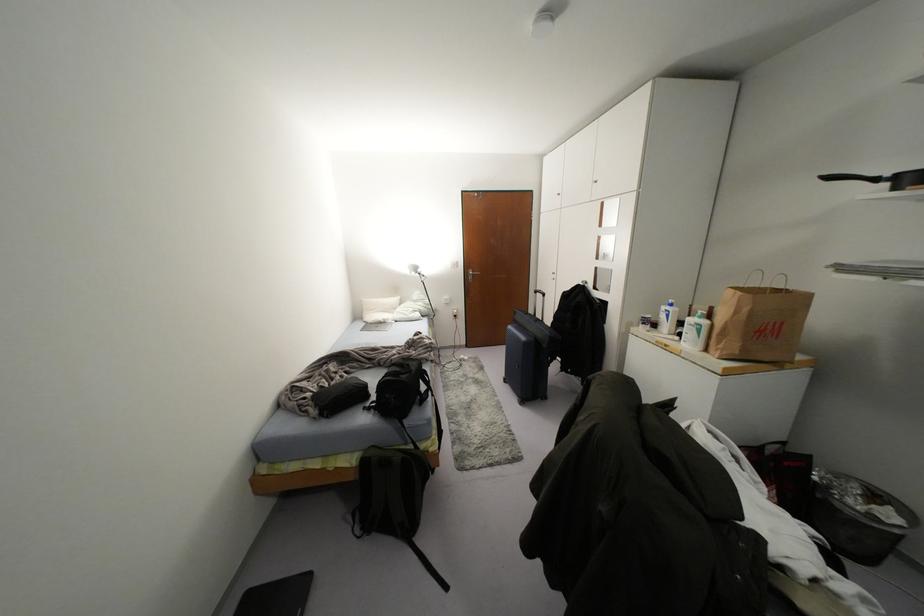
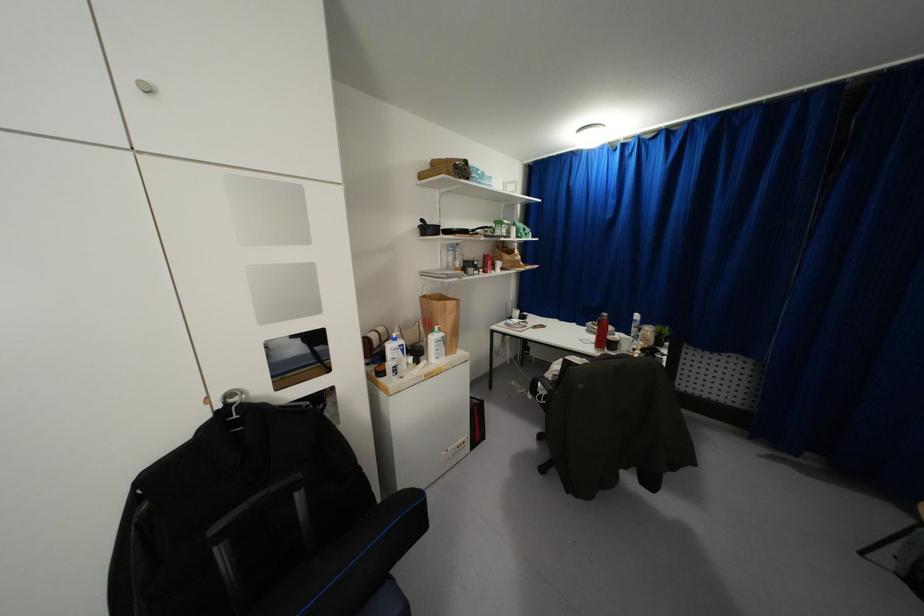
Where in the second image is the point corresponding to (x=829, y=177) from the first image?

(421, 220)